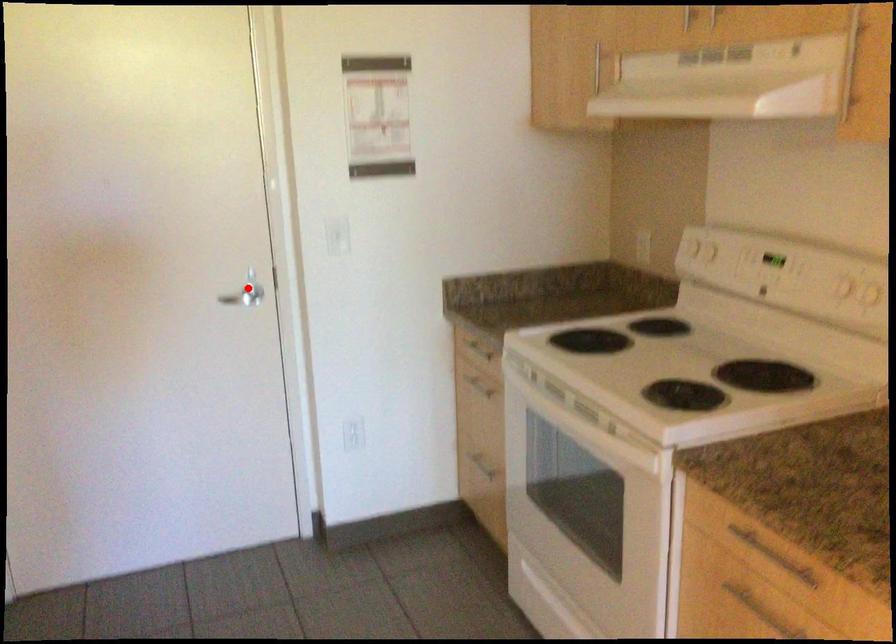
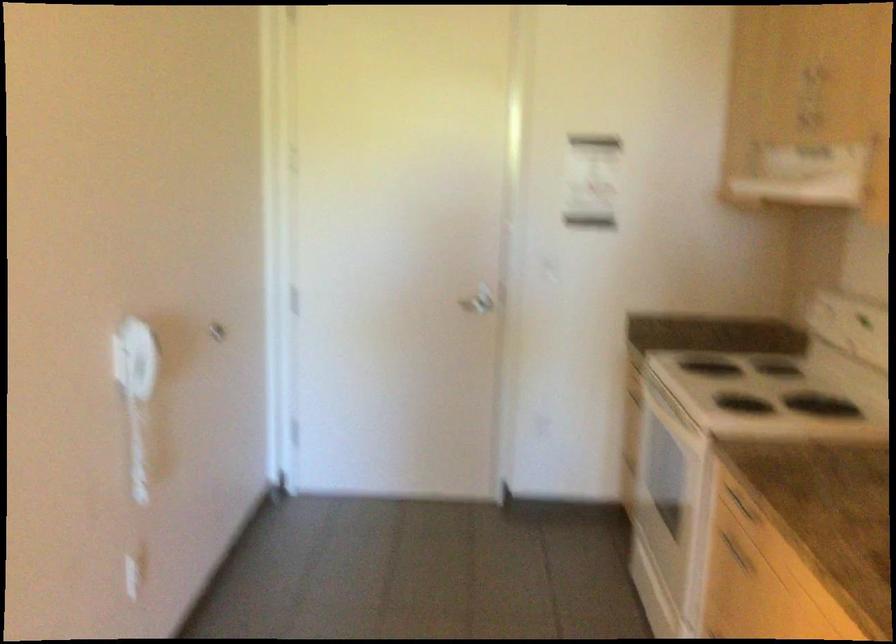
Question: I am providing you with two images of the same scene from different viewpoints. Image1 has a red point marked. In image2, the corresponding 3D location appears at what relative position? Reply with the corresponding letter.

Choices:
 (A) Closer
 (B) Farther

Answer: (B)